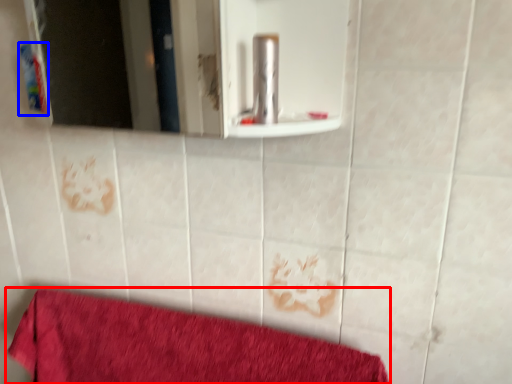
Question: Which object is further to the camera taking this photo, towel (highlighted by a red box) or toiletry (highlighted by a blue box)?

Choices:
 (A) towel
 (B) toiletry

Answer: (B)